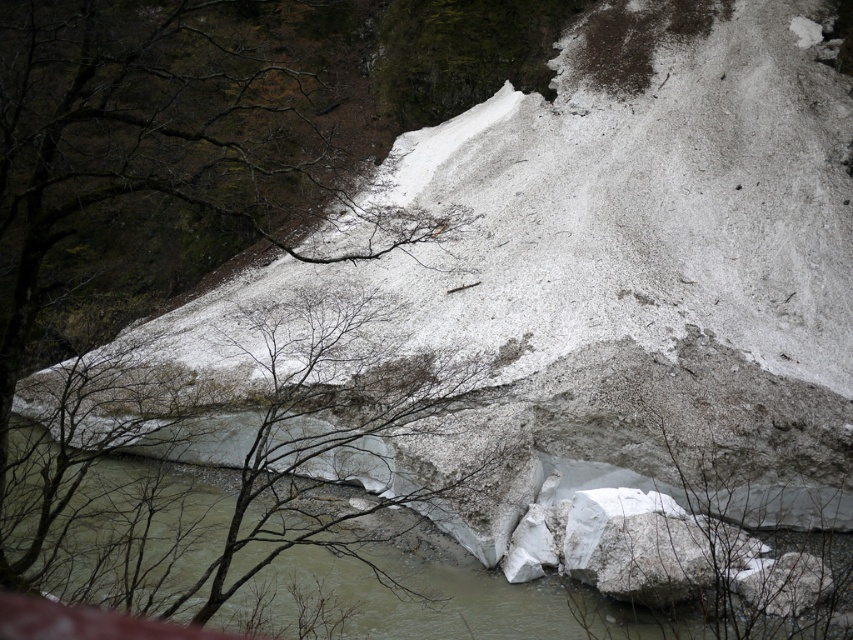
You are a hiker trying to cross the river using the ice. You notice the bare branches at center and the white ice at center. How far apart are these two landmarks from each other?

The bare branches at center is 5.24 feet away from white ice at center.